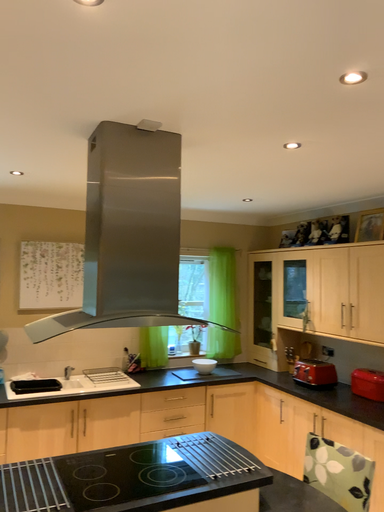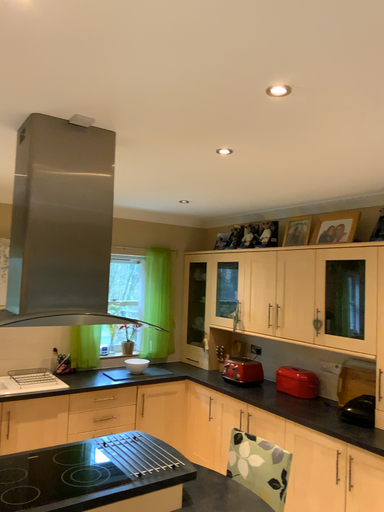
Question: Which way did the camera rotate in the video?

Choices:
 (A) rotated right
 (B) rotated left

Answer: (A)